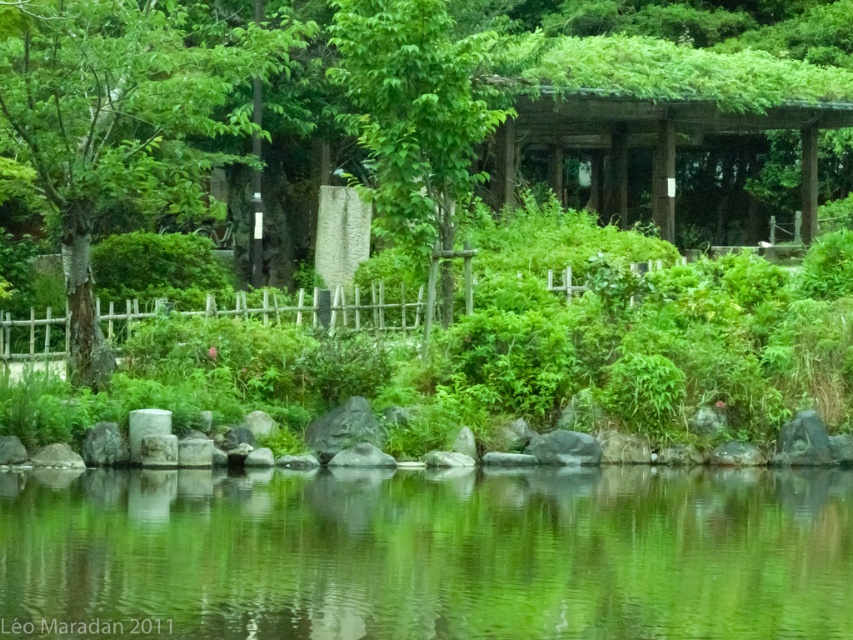
You are a gardener planning to place a new decorative stone statue that is 1 meter tall. You want to ensure it is visible from the path near the green reflective water at center. Will the green leafy bush at center block the view of the statue if placed behind it?

The green leafy bush at center is taller than the green reflective water at center. Since the statue is 1 meter tall and the bush is taller, it may block the view of the statue if placed behind the bush.

You are standing at the point with coordinates (430, 554) in the garden. What is the immediate surface you are standing on?

The immediate surface at point (430, 554) is green reflective water at center.